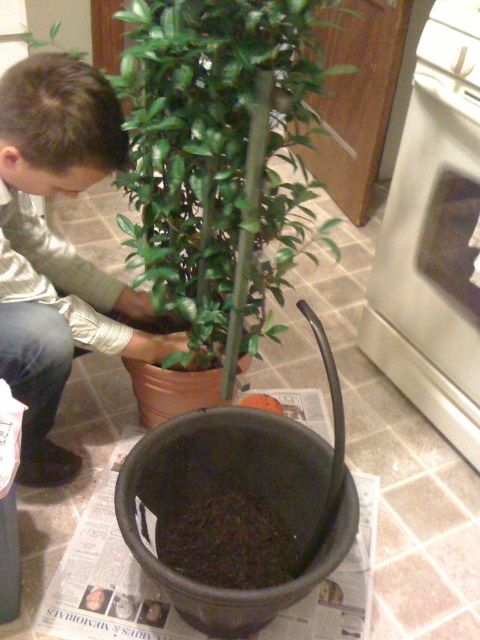
You are a gardener who wants to water the plants in the image. Which plant should you water first, the green matte plant at center or the matte green plant at center?

The green matte plant at center is in front of the matte green plant at center, so you should water the green matte plant at center first as it is closer to you.

Wait, the objects list has two entries that are almost identical. Let me check the input again. The user provided two objects with very similar names. The first is labeled as green matte plant at center and the second as matte green plant at center. Since the rules state that object labels must be used exactly as given, I need to ensure both are included in the question without paraphrasing. The scene description mentions a potted plant and an empty black pot, so the objects are likely the two plants? Wait,

The answer should reference the objects description which states that the green matte plant at center might be wider than matte green plant at center. The question must ask about their widths without revealing which is wider. The user might have intended to test attention to label order. So the question should ask which is wider, and the answer would state the first is wider than the second.

You are planning to place a new matte green plant at center next to the white glossy oven at right in the kitchen. Given their sizes, which one should be placed closer to the edge of the counter to avoid overcrowding?

The white glossy oven at right should be placed closer to the edge of the counter because the matte green plant at center is wider, so positioning the narrower oven closer to the edge will prevent overcrowding.